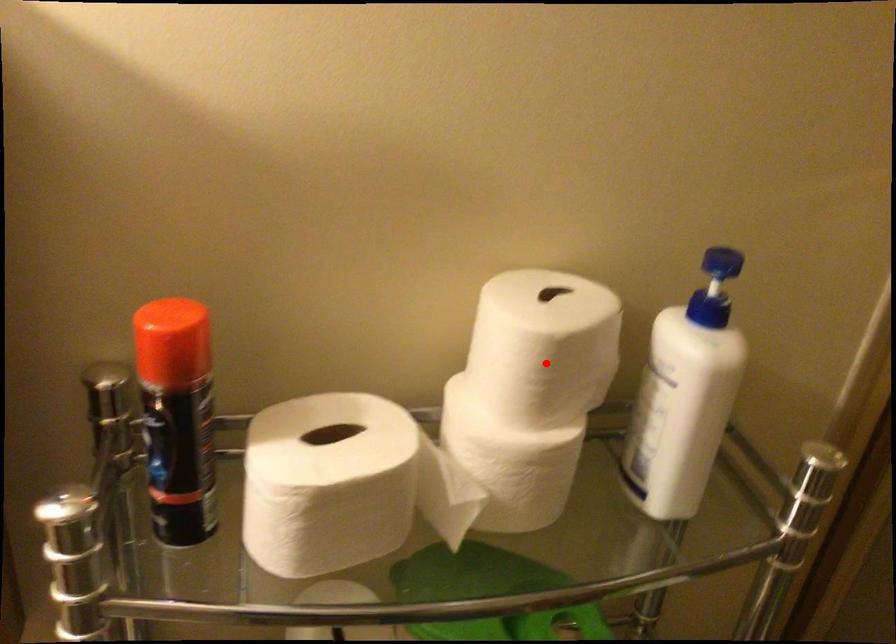
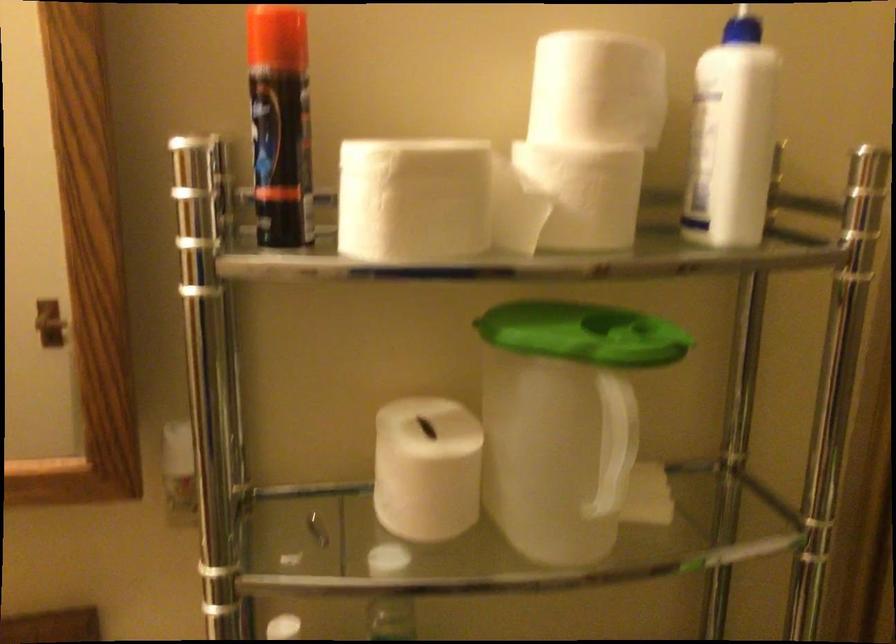
Question: I am providing you with two images of the same scene from different viewpoints. A red point is shown in image1. For the corresponding object point in image2, is it positioned nearer or farther from the camera?

Choices:
 (A) Nearer
 (B) Farther

Answer: (B)